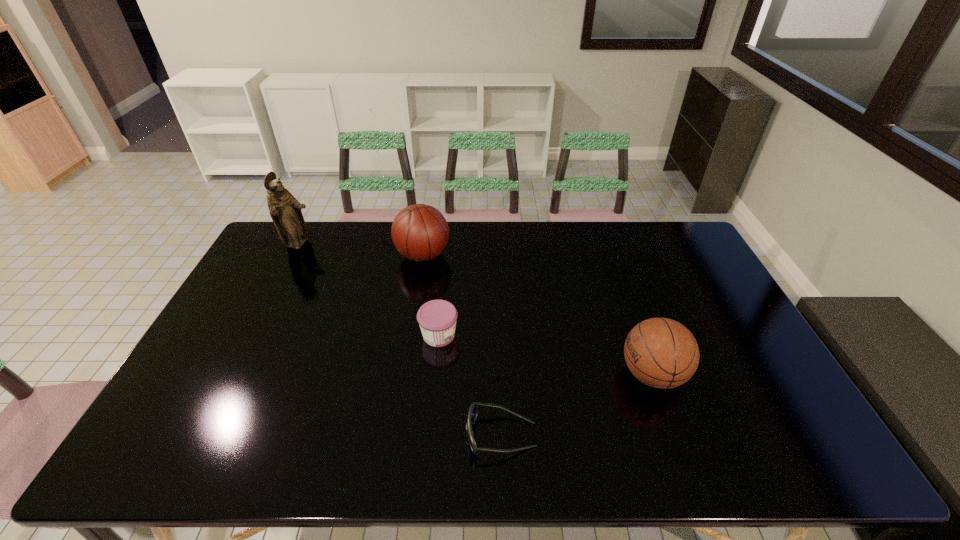
Identify the location of figurine. (285, 210).

Locate an element on the screen. The width and height of the screenshot is (960, 540). the tallest object is located at coordinates (285, 210).

Locate an element on the screen. the left basketball is located at coordinates (420, 232).

This screenshot has width=960, height=540. Find the location of `the right basketball`. the right basketball is located at coordinates (662, 353).

You are a GUI agent. You are given a task and a screenshot of the screen. Output one action in this format:
    pyautogui.click(x=<x>, y=<y>)
    Task: Click on the nearer basketball
    The height and width of the screenshot is (540, 960).
    Given the screenshot: What is the action you would take?
    pyautogui.click(x=662, y=353)

Locate an element on the screen. Image resolution: width=960 pixels, height=540 pixels. jam is located at coordinates (437, 318).

Identify the location of the fourth object from left to right. (473, 410).

The height and width of the screenshot is (540, 960). I want to click on the nearest object, so click(x=473, y=410).

In order to click on vacant region located 0.350m on the front-facing side of the tallest object in this screenshot , I will do `click(409, 245)`.

In order to click on free space located 0.370m on the left of the farther basketball in this screenshot , I will do `click(292, 255)`.